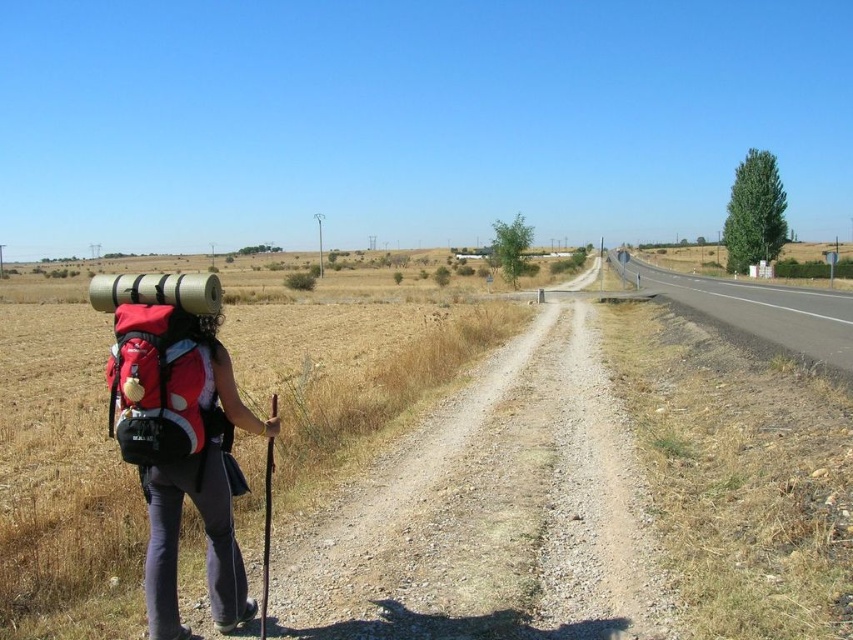
Question: Estimate the real-world distances between objects in this image. Which object is closer to the matte red backpack at left?

Choices:
 (A) asphalt road at right
 (B) red fabric backpack at left
 (C) dusty gravel path at center

Answer: (B)

Question: Is asphalt road at right above red fabric backpack at left?

Choices:
 (A) no
 (B) yes

Answer: (B)

Question: Which object is farther from the camera taking this photo?

Choices:
 (A) asphalt road at right
 (B) dusty gravel path at center
 (C) matte red backpack at left

Answer: (A)

Question: Does matte red backpack at left appear on the left side of red fabric backpack at left?

Choices:
 (A) no
 (B) yes

Answer: (B)

Question: Is asphalt road at right smaller than red fabric backpack at left?

Choices:
 (A) no
 (B) yes

Answer: (A)

Question: Which point appears farthest from the camera in this image?

Choices:
 (A) (462, 416)
 (B) (207, 547)
 (C) (143, 358)
 (D) (662, 282)

Answer: (D)